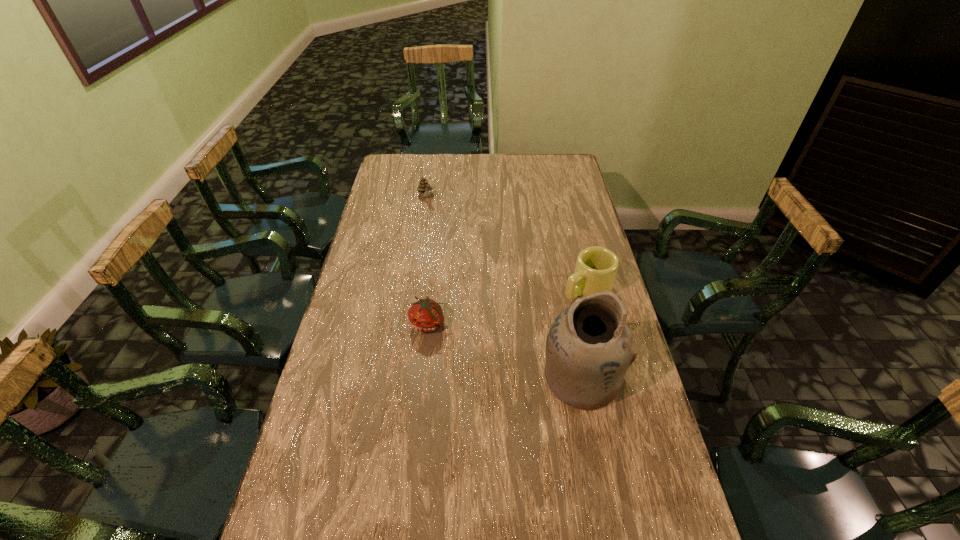
Locate an element on the screen. This screenshot has height=540, width=960. blank space that satisfies the following two spatial constraints: 1. on the front-facing side of the tomato; 2. on the left side of the pottery is located at coordinates (422, 377).

Locate an element on the screen. This screenshot has height=540, width=960. vacant region that satisfies the following two spatial constraints: 1. on the front side of the snail; 2. on the right side of the tallest object is located at coordinates (396, 377).